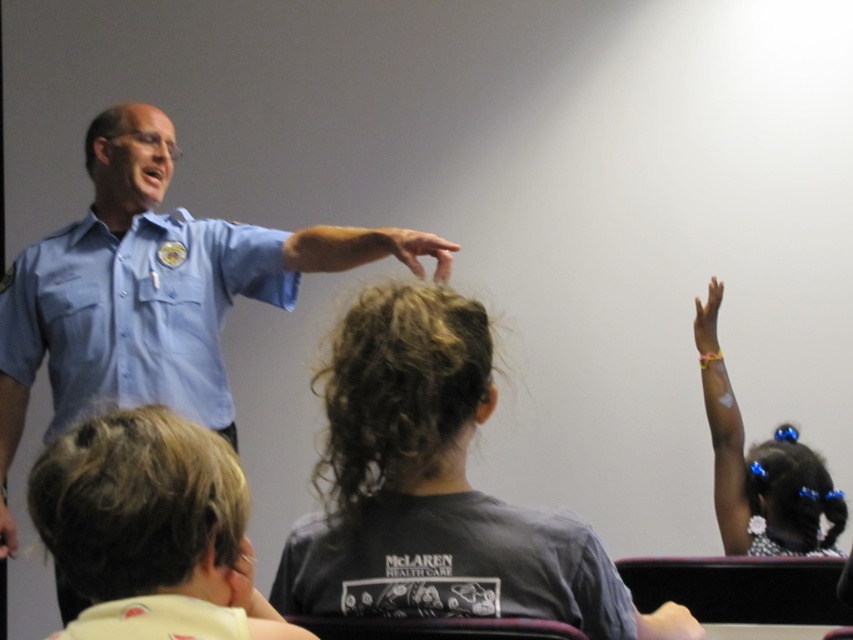
Does blonde hair at lower left appear over matte blue shirt at center?

No, blonde hair at lower left is not above matte blue shirt at center.

Based on the photo, between blonde hair at lower left and matte blue shirt at center, which one appears on the left side from the viewer's perspective?

From the viewer's perspective, blonde hair at lower left appears more on the left side.

The width and height of the screenshot is (853, 640). What do you see at coordinates (151, 529) in the screenshot? I see `blonde hair at lower left` at bounding box center [151, 529].

Where is `blonde hair at lower left`? The height and width of the screenshot is (640, 853). blonde hair at lower left is located at coordinates coord(151,529).

Does blue uniform shirt at upper left appear on the right side of yellow rubber glove at upper right?

In fact, blue uniform shirt at upper left is to the left of yellow rubber glove at upper right.

Between point (59, 257) and point (715, 312), which one is positioned behind?

Positioned behind is point (715, 312).

The image size is (853, 640). Identify the location of blue uniform shirt at upper left. (138, 292).

Find the location of `blue uniform shirt at upper left`. blue uniform shirt at upper left is located at coordinates (138, 292).

Who is taller, dark gray t-shirt at center or black dotted dress at upper right?

With more height is black dotted dress at upper right.

Is point (584, 529) positioned after point (724, 481)?

No, it is in front of (724, 481).

Between point (436, 404) and point (808, 538), which one is positioned in front?

Point (436, 404) is in front.

Locate an element on the screen. Image resolution: width=853 pixels, height=640 pixels. dark gray t-shirt at center is located at coordinates (434, 490).